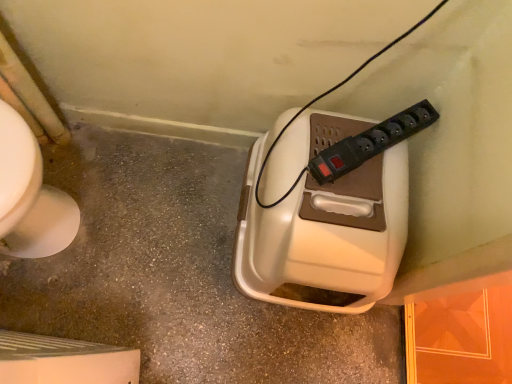
The image size is (512, 384). What are the coordinates of `black plastic power plugs and sockets at upper center` in the screenshot? It's located at (370, 143).

I want to click on beige plastic container at center, so click(178, 274).

The width and height of the screenshot is (512, 384). In order to click on white plastic hand dryer at center in this screenshot , I will do `click(325, 231)`.

From the image's perspective, which one is positioned lower, white plastic hand dryer at center or black plastic power plugs and sockets at upper center?

white plastic hand dryer at center is shown below in the image.

From a real-world perspective, which is physically below, white plastic hand dryer at center or black plastic power plugs and sockets at upper center?

white plastic hand dryer at center.

In terms of height, does white plastic hand dryer at center look taller or shorter compared to black plastic power plugs and sockets at upper center?

Clearly, white plastic hand dryer at center is taller compared to black plastic power plugs and sockets at upper center.

Based on their sizes in the image, would you say white plastic hand dryer at center is bigger or smaller than black plastic power plugs and sockets at upper center?

Clearly, white plastic hand dryer at center is larger in size than black plastic power plugs and sockets at upper center.

Can you confirm if white plastic hand dryer at center is bigger than beige plastic container at center?

Indeed, white plastic hand dryer at center has a larger size compared to beige plastic container at center.

Is beige plastic container at center at the back of white plastic hand dryer at center?

No, white plastic hand dryer at center's orientation is not away from beige plastic container at center.

From the image's perspective, is beige plastic container at center positioned above or below black plastic power plugs and sockets at upper center?

beige plastic container at center is situated lower than black plastic power plugs and sockets at upper center in the image.

Is beige plastic container at center not within black plastic power plugs and sockets at upper center?

Indeed, beige plastic container at center is completely outside black plastic power plugs and sockets at upper center.

Does beige plastic container at center come in front of black plastic power plugs and sockets at upper center?

No, it is behind black plastic power plugs and sockets at upper center.

Looking at this image, does black plastic power plugs and sockets at upper center have a greater height compared to white plastic hand dryer at center?

No.

From a real-world perspective, which object rests below the other?

white plastic hand dryer at center is physically lower.

Is black plastic power plugs and sockets at upper center situated inside white plastic hand dryer at center or outside?

black plastic power plugs and sockets at upper center is located beyond the bounds of white plastic hand dryer at center.

Considering the relative positions of black plastic power plugs and sockets at upper center and beige plastic container at center in the image provided, is black plastic power plugs and sockets at upper center behind beige plastic container at center?

No.

Could you tell me if black plastic power plugs and sockets at upper center is facing beige plastic container at center?

No.

Considering the sizes of objects black plastic power plugs and sockets at upper center and beige plastic container at center in the image provided, who is smaller, black plastic power plugs and sockets at upper center or beige plastic container at center?

black plastic power plugs and sockets at upper center.

Considering the positions of points (405, 125) and (182, 348), is point (405, 125) farther from camera compared to point (182, 348)?

No, (405, 125) is in front of (182, 348).

From the image's perspective, which one is positioned lower, beige plastic container at center or white plastic hand dryer at center?

beige plastic container at center is shown below in the image.

From the picture: Which of these two, beige plastic container at center or white plastic hand dryer at center, is thinner?

Thinner between the two is white plastic hand dryer at center.

Could you tell me if beige plastic container at center is facing white plastic hand dryer at center?

No, beige plastic container at center is not aimed at white plastic hand dryer at center.

Is beige plastic container at center far from white plastic hand dryer at center?

Actually, beige plastic container at center and white plastic hand dryer at center are a little close together.

This screenshot has height=384, width=512. In the image, there is a white plastic hand dryer at center. Identify the location of power plugs and sockets above it (from the image's perspective). tap(370, 143).

This screenshot has height=384, width=512. Find the location of `hand dryer in front of the beige plastic container at center`. hand dryer in front of the beige plastic container at center is located at coordinates click(x=325, y=231).

Looking at the image, which one is located further to black plastic power plugs and sockets at upper center, white plastic hand dryer at center or beige plastic container at center?

Among the two, beige plastic container at center is located further to black plastic power plugs and sockets at upper center.

Considering their positions, is black plastic power plugs and sockets at upper center positioned further to beige plastic container at center than white plastic hand dryer at center?

black plastic power plugs and sockets at upper center.

Looking at the image, which one is located closer to black plastic power plugs and sockets at upper center, beige plastic container at center or white plastic hand dryer at center?

white plastic hand dryer at center lies closer to black plastic power plugs and sockets at upper center than the other object.

Looking at the image, which one is located further to white plastic hand dryer at center, beige plastic container at center or black plastic power plugs and sockets at upper center?

Among the two, beige plastic container at center is located further to white plastic hand dryer at center.

Considering their positions, is white plastic hand dryer at center positioned closer to beige plastic container at center than black plastic power plugs and sockets at upper center?

Among the two, white plastic hand dryer at center is located nearer to beige plastic container at center.

Based on their spatial positions, is black plastic power plugs and sockets at upper center or beige plastic container at center closer to white plastic hand dryer at center?

A: black plastic power plugs and sockets at upper center.

The height and width of the screenshot is (384, 512). I want to click on hand dryer between beige plastic container at center and black plastic power plugs and sockets at upper center from left to right, so click(325, 231).